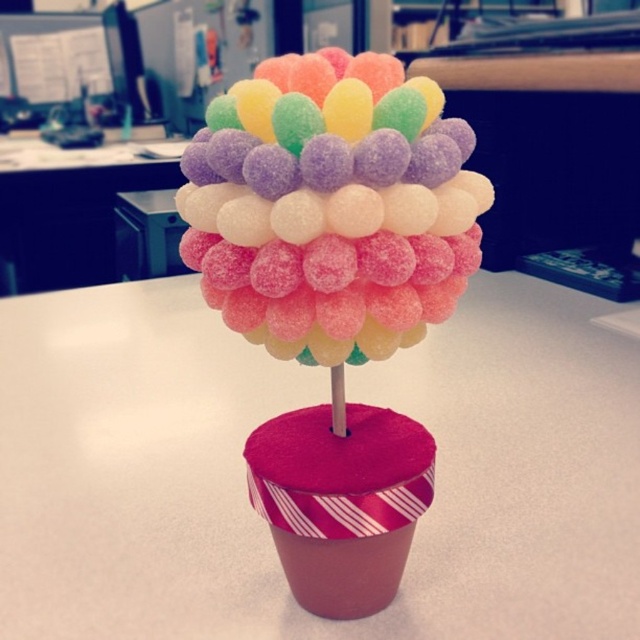
You are a delivery person who needs to place a box on the white glossy table at upper center. The box is 3 feet long. Can you safely place the box on the table without it hanging over the edge? Consider the distance between the glossy plastic candy at center and the table.

The glossy plastic candy at center is 3.48 feet away from the white glossy table at upper center. Since the box is only 3 feet long, it can be placed on the table without overhanging as the distance between the candy and the table is sufficient to accommodate the box length.

Consider the image. You are a child who wants to reach the glossy plastic candy at center to taste it. Considering the white matte table at center is much taller than the candy, can you easily grab the candy without climbing?

The white matte table at center is much taller than the glossy plastic candy at center, so the candy is positioned lower and within easy reach. Therefore, you can easily grab the glossy plastic candy at center without needing to climb.

You are setting up a display and need to place a tall vase on one of the tables. Based on the scene, which table, the white matte table at center or the white glossy table at upper center, can support the vase without it being too low?

The white matte table at center has a greater height compared to the white glossy table at upper center, so the white matte table at center can support the vase without it being too low.